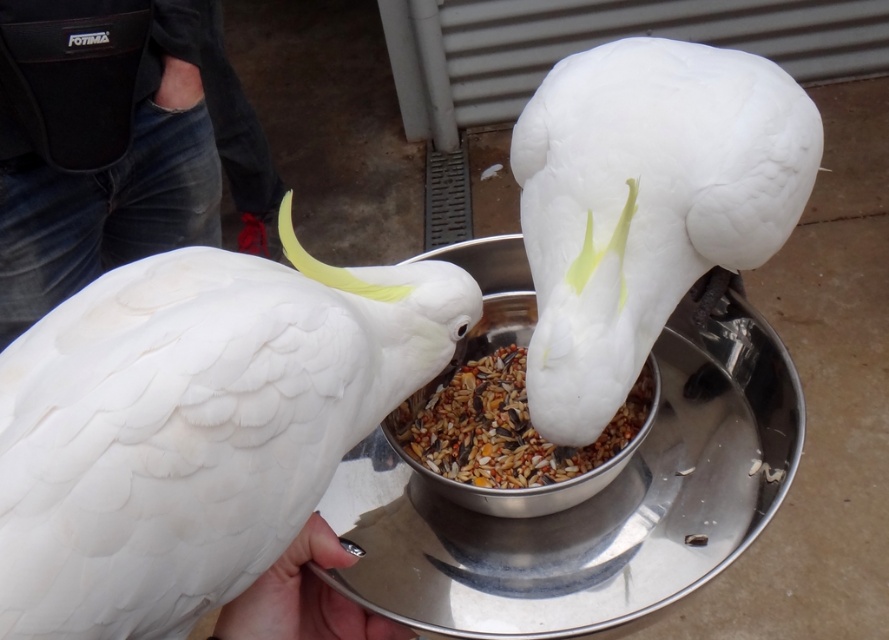
Can you confirm if metallic silver plate at center is shorter than multicolored grain mix at center?

Incorrect, metallic silver plate at center's height does not fall short of multicolored grain mix at center's.

Does metallic silver plate at center appear under multicolored grain mix at center?

Correct, metallic silver plate at center is located below multicolored grain mix at center.

Between point (391, 561) and point (404, 410), which one is positioned in front?

Point (391, 561) is more forward.

The height and width of the screenshot is (640, 889). In order to click on metallic silver plate at center in this screenshot , I will do `click(589, 504)`.

In the scene shown: Does multicolored grain mix at center lie in front of white matte hand at lower center?

No, it is not.

Which is more to the left, multicolored grain mix at center or white matte hand at lower center?

From the viewer's perspective, white matte hand at lower center appears more on the left side.

This screenshot has height=640, width=889. In order to click on multicolored grain mix at center in this screenshot , I will do `click(503, 428)`.

Identify the location of multicolored grain mix at center. (503, 428).

Does point (631, 563) come closer to viewer compared to point (316, 627)?

No, it is behind (316, 627).

Is metallic silver plate at center taller than white matte hand at lower center?

Yes.

The height and width of the screenshot is (640, 889). I want to click on metallic silver plate at center, so click(589, 504).